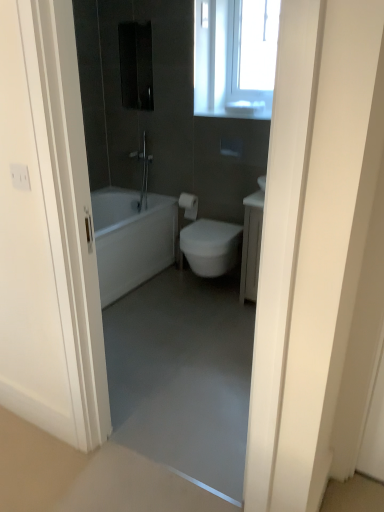
Question: Is matte silver shower at center located outside white glossy door at upper center?

Choices:
 (A) no
 (B) yes

Answer: (B)

Question: From the image's perspective, is matte silver shower at center on top of white glossy door at upper center?

Choices:
 (A) yes
 (B) no

Answer: (A)

Question: Does matte silver shower at center appear on the right side of white glossy door at upper center?

Choices:
 (A) yes
 (B) no

Answer: (B)

Question: From the image's perspective, is matte silver shower at center beneath white glossy door at upper center?

Choices:
 (A) no
 (B) yes

Answer: (A)

Question: From a real-world perspective, does matte silver shower at center sit lower than white glossy door at upper center?

Choices:
 (A) yes
 (B) no

Answer: (A)

Question: From a real-world perspective, is matte silver shower at center positioned above or below transparent plastic window at upper right?

Choices:
 (A) above
 (B) below

Answer: (B)

Question: Would you say matte silver shower at center is to the left or to the right of transparent plastic window at upper right in the picture?

Choices:
 (A) left
 (B) right

Answer: (A)

Question: Would you say matte silver shower at center is inside or outside transparent plastic window at upper right?

Choices:
 (A) inside
 (B) outside

Answer: (B)

Question: From the image's perspective, relative to transparent plastic window at upper right, is matte silver shower at center above or below?

Choices:
 (A) above
 (B) below

Answer: (B)

Question: Considering the positions of white glossy door at upper center and transparent plastic window at upper right in the image, is white glossy door at upper center wider or thinner than transparent plastic window at upper right?

Choices:
 (A) wide
 (B) thin

Answer: (B)

Question: From a real-world perspective, relative to transparent plastic window at upper right, is white glossy door at upper center vertically above or below?

Choices:
 (A) above
 (B) below

Answer: (B)

Question: In terms of height, does white glossy door at upper center look taller or shorter compared to transparent plastic window at upper right?

Choices:
 (A) tall
 (B) short

Answer: (A)

Question: Is point (271, 432) positioned closer to the camera than point (258, 22)?

Choices:
 (A) closer
 (B) farther

Answer: (A)

Question: From the image's perspective, is transparent plastic window at upper right positioned above or below white matte toilet paper at center?

Choices:
 (A) above
 (B) below

Answer: (A)

Question: Is transparent plastic window at upper right bigger or smaller than white matte toilet paper at center?

Choices:
 (A) small
 (B) big

Answer: (B)